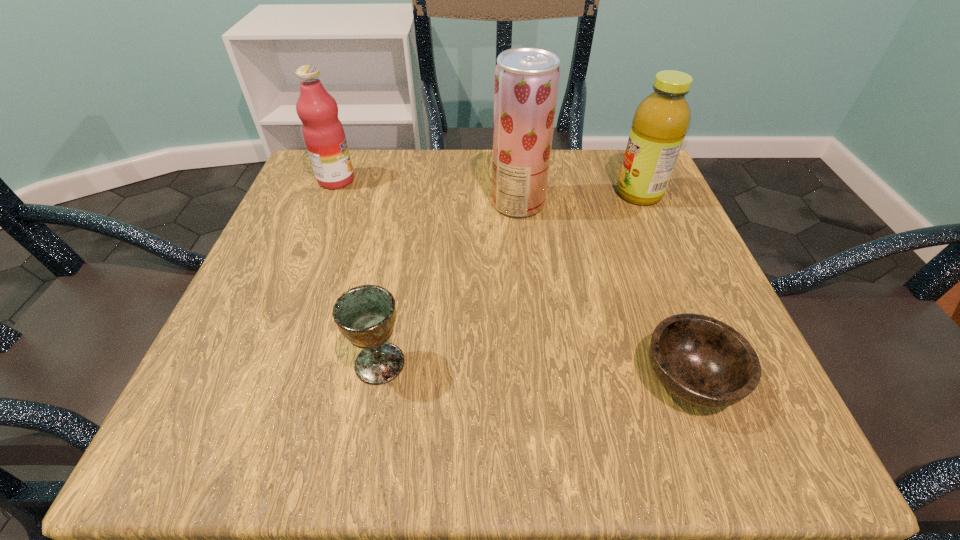
Locate an element on the screen. The height and width of the screenshot is (540, 960). vacant area located 0.100m on the front label of the rightmost fruit juice is located at coordinates (567, 194).

Identify the location of vacant space located on the label of the leftmost fruit juice. This screenshot has height=540, width=960. (492, 180).

Locate an element on the screen. free space located on the back of the chalice is located at coordinates (406, 220).

Find the location of a particular element. The width and height of the screenshot is (960, 540). free spot located 0.200m on the left of the shortest object is located at coordinates (498, 379).

Locate an element on the screen. object present at the near edge is located at coordinates (703, 361).

Locate an element on the screen. The image size is (960, 540). object present at the left edge is located at coordinates (324, 136).

Locate an element on the screen. fruit juice located in the right edge section of the desktop is located at coordinates (661, 121).

This screenshot has width=960, height=540. In order to click on bowl at the right edge in this screenshot , I will do `click(703, 361)`.

Identify the location of object at the far left corner. (x=324, y=136).

At what (x,y) coordinates should I click in order to perform the action: click on object located in the far right corner section of the desktop. Please return your answer as a coordinate pair (x, y). Looking at the image, I should click on (661, 121).